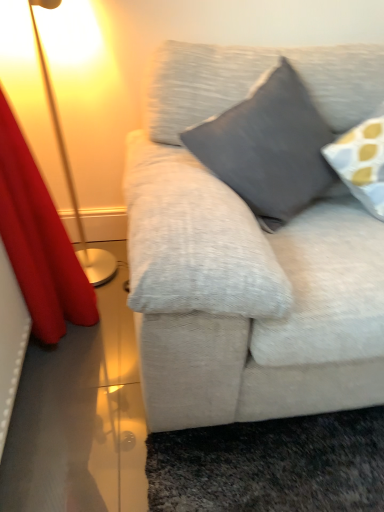
Question: Is red velvet curtain at left completely or partially outside of metallic gold lamp at left?

Choices:
 (A) no
 (B) yes

Answer: (B)

Question: Is metallic gold lamp at left inside red velvet curtain at left?

Choices:
 (A) yes
 (B) no

Answer: (B)

Question: From a real-world perspective, is red velvet curtain at left positioned under metallic gold lamp at left based on gravity?

Choices:
 (A) yes
 (B) no

Answer: (B)

Question: Is red velvet curtain at left to the right of metallic gold lamp at left from the viewer's perspective?

Choices:
 (A) no
 (B) yes

Answer: (B)

Question: From the image's perspective, is red velvet curtain at left beneath metallic gold lamp at left?

Choices:
 (A) yes
 (B) no

Answer: (A)

Question: Can you confirm if red velvet curtain at left is shorter than metallic gold lamp at left?

Choices:
 (A) no
 (B) yes

Answer: (A)

Question: Is metallic gold lamp at left shorter than red velvet curtain at left?

Choices:
 (A) yes
 (B) no

Answer: (A)

Question: Is metallic gold lamp at left facing towards red velvet curtain at left?

Choices:
 (A) no
 (B) yes

Answer: (A)

Question: From the image's perspective, would you say metallic gold lamp at left is positioned over red velvet curtain at left?

Choices:
 (A) yes
 (B) no

Answer: (A)

Question: Is metallic gold lamp at left turned away from red velvet curtain at left?

Choices:
 (A) no
 (B) yes

Answer: (A)

Question: From a real-world perspective, is metallic gold lamp at left on top of red velvet curtain at left?

Choices:
 (A) yes
 (B) no

Answer: (B)

Question: From a real-world perspective, is metallic gold lamp at left below red velvet curtain at left?

Choices:
 (A) yes
 (B) no

Answer: (A)

Question: Is dark gray fabric pillow at center aimed at metallic gold lamp at left?

Choices:
 (A) no
 (B) yes

Answer: (A)